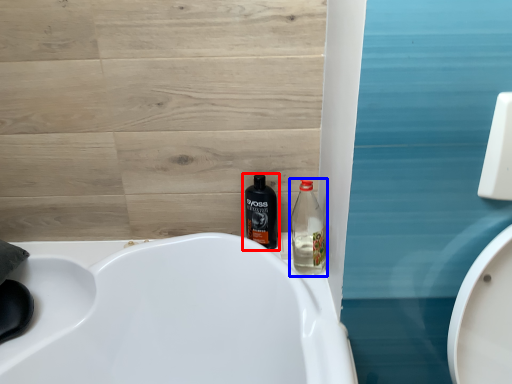
Question: Which of the following is the closest to the observer, bottle (highlighted by a red box) or bottle (highlighted by a blue box)?

Choices:
 (A) bottle
 (B) bottle

Answer: (B)